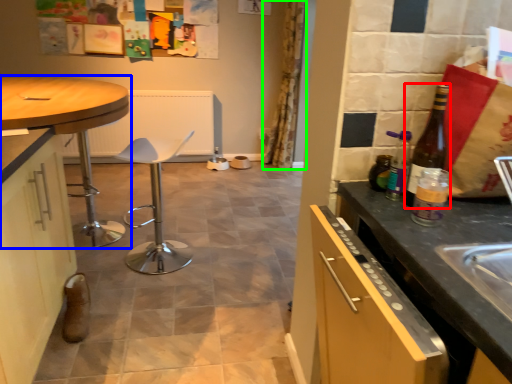
Question: Which object is positioned farthest from bottle (highlighted by a red box)? Select from table (highlighted by a blue box) and curtain (highlighted by a green box).

Choices:
 (A) table
 (B) curtain

Answer: (B)